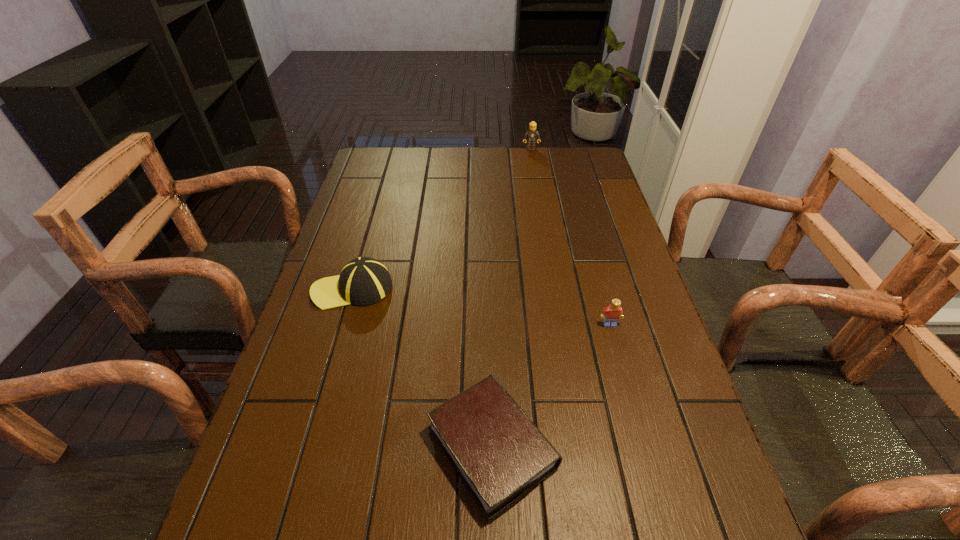
This screenshot has width=960, height=540. I want to click on free point that satisfies the following two spatial constraints: 1. with the brim of the nearest object facing forward; 2. on the left side of the leftmost object, so click(306, 448).